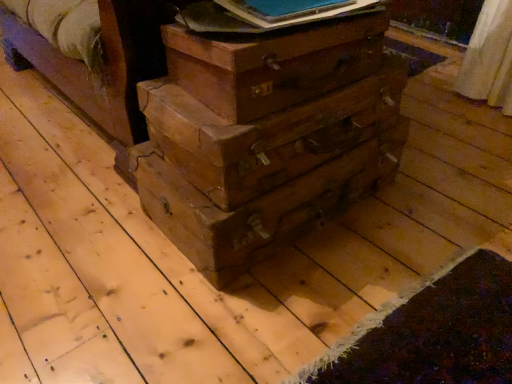
Question: From the image's perspective, is wooden suitcase at center above or below blue paper at upper center?

Choices:
 (A) below
 (B) above

Answer: (A)

Question: Looking at the image, does wooden suitcase at center seem bigger or smaller compared to blue paper at upper center?

Choices:
 (A) big
 (B) small

Answer: (A)

Question: Based on their relative distances, which object is nearer to the blue paper at upper center?

Choices:
 (A) wooden drawer at center, which is counted as the 1th drawer, starting from the bottom
 (B) wooden suitcase at center
 (C) wooden drawer at center, which is the 1th drawer from top to bottom

Answer: (B)

Question: Considering the real-world distances, which object is farthest from the wooden drawer at center, the second drawer positioned from the bottom?

Choices:
 (A) wooden drawer at center, placed as the second drawer when sorted from top to bottom
 (B) blue paper at upper center
 (C) wooden suitcase at center

Answer: (B)